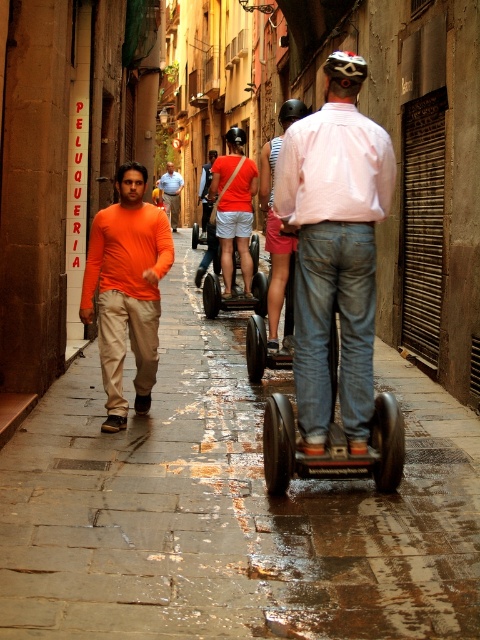
Which is more to the right, black rubber scooter at center or orange matte shirt at center?

black rubber scooter at center is more to the right.

Which is below, black rubber scooter at center or orange matte shirt at center?

black rubber scooter at center is lower down.

Is point (253, 307) positioned behind point (164, 188)?

That is False.

Identify the location of black rubber scooter at center. (237, 292).

Between pink fabric shirt at center and pink fabric shorts at center, which one appears on the left side from the viewer's perspective?

Positioned to the left is pink fabric shorts at center.

Based on the photo, can you confirm if pink fabric shirt at center is shorter than pink fabric shorts at center?

Yes, pink fabric shirt at center is shorter than pink fabric shorts at center.

You are a GUI agent. You are given a task and a screenshot of the screen. Output one action in this format:
    pyautogui.click(x=<x>, y=<y>)
    Task: Click on the pink fabric shirt at center
    
    Given the screenshot: What is the action you would take?
    pyautogui.click(x=335, y=248)

The image size is (480, 640). What are the coordinates of `orange matte shirt at left` in the screenshot? It's located at (127, 289).

Consider the image. Who is more forward, (112, 376) or (292, 113)?

Point (112, 376)

Between point (107, 365) and point (271, 285), which one is positioned in front?

Point (107, 365) is more forward.

Locate an element on the screen. Image resolution: width=480 pixels, height=640 pixels. orange matte shirt at left is located at coordinates (127, 289).